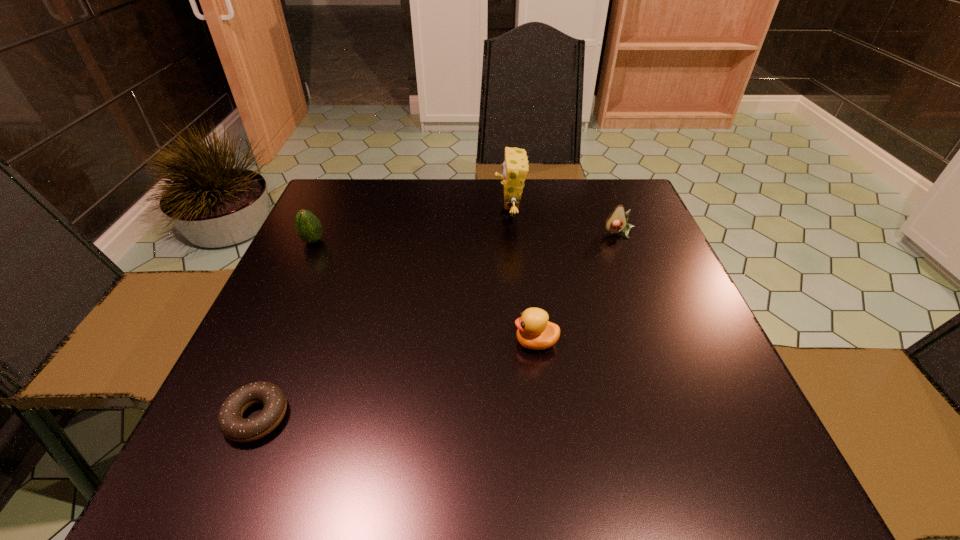
Where is `object that is positioned at the near left corner`? This screenshot has width=960, height=540. object that is positioned at the near left corner is located at coordinates (232, 425).

The image size is (960, 540). I want to click on free region at the far edge of the desktop, so click(x=483, y=222).

Image resolution: width=960 pixels, height=540 pixels. Identify the location of vacant space at the near edge. (586, 445).

This screenshot has height=540, width=960. Find the location of `vacant space at the left edge of the desktop`. vacant space at the left edge of the desktop is located at coordinates pos(309,339).

Where is `free space at the right edge of the desktop`? free space at the right edge of the desktop is located at coordinates (682, 334).

At what (x,y) coordinates should I click in order to perform the action: click on vacant space at the far left corner. Please return your answer as a coordinate pair (x, y). The height and width of the screenshot is (540, 960). Looking at the image, I should click on (349, 213).

What are the coordinates of `vacant point at the near left corner` in the screenshot? It's located at (210, 466).

Locate an element on the screen. This screenshot has width=960, height=540. free region at the far right corner of the desktop is located at coordinates (632, 193).

Locate an element on the screen. empty space that is in between the fourth farthest object and the right avocado is located at coordinates (577, 288).

Locate an element on the screen. This screenshot has height=540, width=960. free spot between the second nearest object and the left avocado is located at coordinates (424, 292).